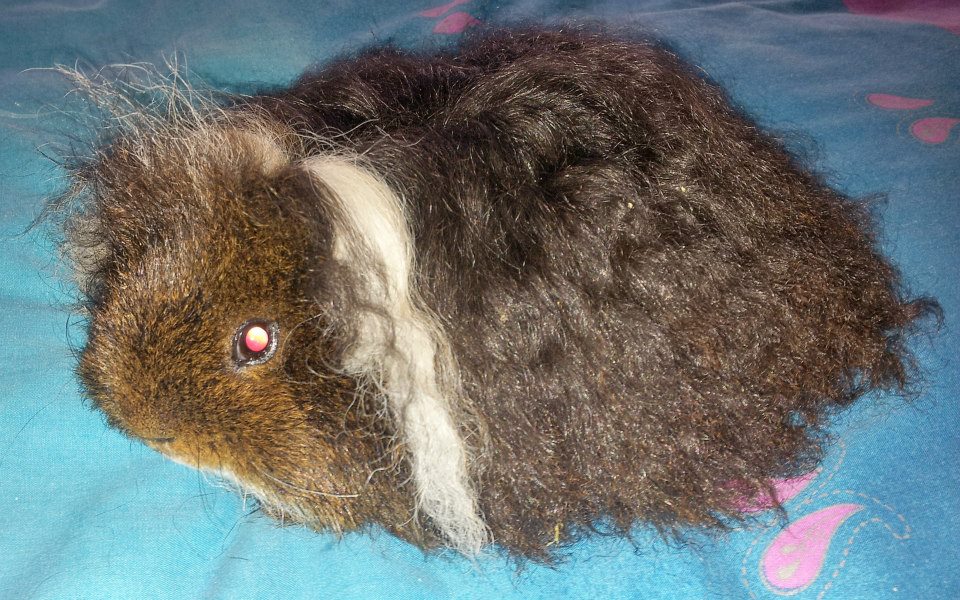
Identify the location of bed. The image size is (960, 600). (834, 59).